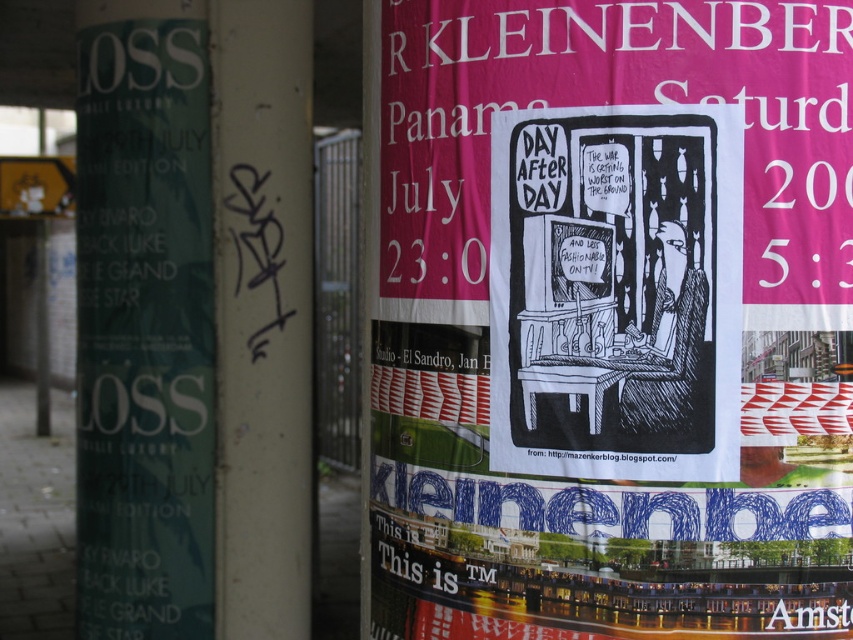
Question: Which object appears closest to the camera in this image?

Choices:
 (A) black paper poster at center
 (B) white painted pillar at center

Answer: (A)

Question: Is the position of black paper poster at center less distant than that of white painted pillar at center?

Choices:
 (A) yes
 (B) no

Answer: (A)

Question: Does black paper poster at center lie behind white painted pillar at center?

Choices:
 (A) yes
 (B) no

Answer: (B)

Question: Among these objects, which one is nearest to the camera?

Choices:
 (A) white painted pillar at center
 (B) black paper poster at center

Answer: (B)

Question: Where is black paper poster at center located in relation to white painted pillar at center in the image?

Choices:
 (A) right
 (B) left

Answer: (A)